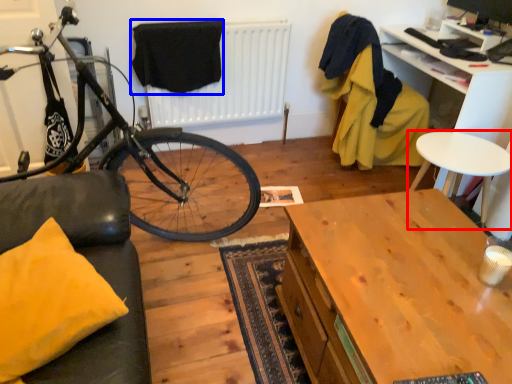
Question: Which object is further to the camera taking this photo, table (highlighted by a red box) or clothe (highlighted by a blue box)?

Choices:
 (A) table
 (B) clothe

Answer: (B)